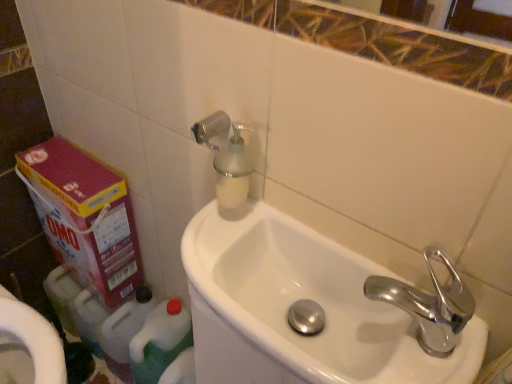
Question: Should I look upward or downward to see chrome metallic faucet at right?

Choices:
 (A) down
 (B) up

Answer: (A)

Question: From the image's perspective, is pink cardboard box at lower left over white glossy sink at center?

Choices:
 (A) no
 (B) yes

Answer: (B)

Question: From the image's perspective, is pink cardboard box at lower left located beneath white glossy sink at center?

Choices:
 (A) yes
 (B) no

Answer: (B)

Question: Considering the relative positions of pink cardboard box at lower left and white glossy sink at center in the image provided, is pink cardboard box at lower left behind white glossy sink at center?

Choices:
 (A) no
 (B) yes

Answer: (B)

Question: Is pink cardboard box at lower left outside white glossy sink at center?

Choices:
 (A) no
 (B) yes

Answer: (B)

Question: Is white glossy sink at center at the back of pink cardboard box at lower left?

Choices:
 (A) yes
 (B) no

Answer: (B)

Question: Is pink cardboard box at lower left aimed at white glossy sink at center?

Choices:
 (A) yes
 (B) no

Answer: (B)

Question: From a real-world perspective, is green plastic bottle at lower left, which ranks as the 2th cleaning product in right-to-left order, located beneath chrome metallic faucet at right?

Choices:
 (A) yes
 (B) no

Answer: (A)

Question: Are green plastic bottle at lower left, which ranks as the 2th cleaning product in right-to-left order, and chrome metallic faucet at right making contact?

Choices:
 (A) no
 (B) yes

Answer: (A)

Question: Can chrome metallic faucet at right be found inside green plastic bottle at lower left, which ranks as the 2th cleaning product in right-to-left order?

Choices:
 (A) no
 (B) yes

Answer: (A)

Question: Is green plastic bottle at lower left, which ranks as the 2th cleaning product in right-to-left order, turned away from chrome metallic faucet at right?

Choices:
 (A) yes
 (B) no

Answer: (B)

Question: Does green plastic bottle at lower left, which ranks as the 2th cleaning product in right-to-left order, have a greater width compared to chrome metallic faucet at right?

Choices:
 (A) yes
 (B) no

Answer: (A)

Question: Is green plastic bottle at lower left, which ranks as the 2th cleaning product in right-to-left order, not within chrome metallic faucet at right?

Choices:
 (A) no
 (B) yes

Answer: (B)

Question: Is green plastic bottle at lower left, which ranks as the 2th cleaning product in right-to-left order, outside of silver metallic soap dispenser at upper center?

Choices:
 (A) yes
 (B) no

Answer: (A)